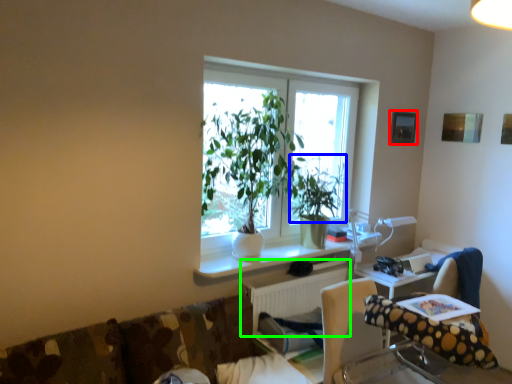
Question: Which object is the closest to the picture frame (highlighted by a red box)? Choose among these: vegetation (highlighted by a blue box) or radiator (highlighted by a green box).

Choices:
 (A) vegetation
 (B) radiator

Answer: (A)